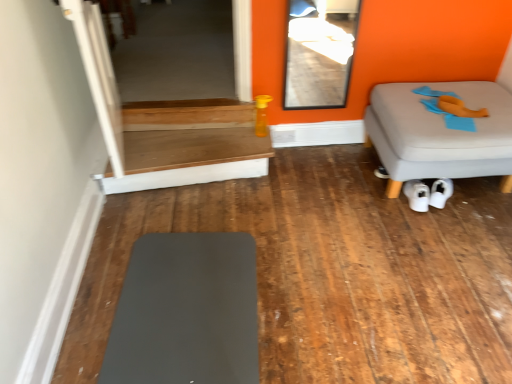
Find the location of a particular element. The width and height of the screenshot is (512, 384). vacant area to the right of wooden table at center is located at coordinates (301, 187).